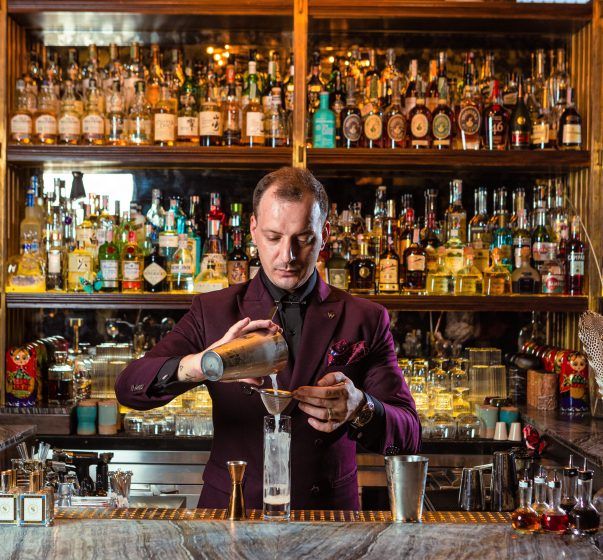
Find the location of a particular element. The width and height of the screenshot is (603, 560). bar is located at coordinates (233, 536).